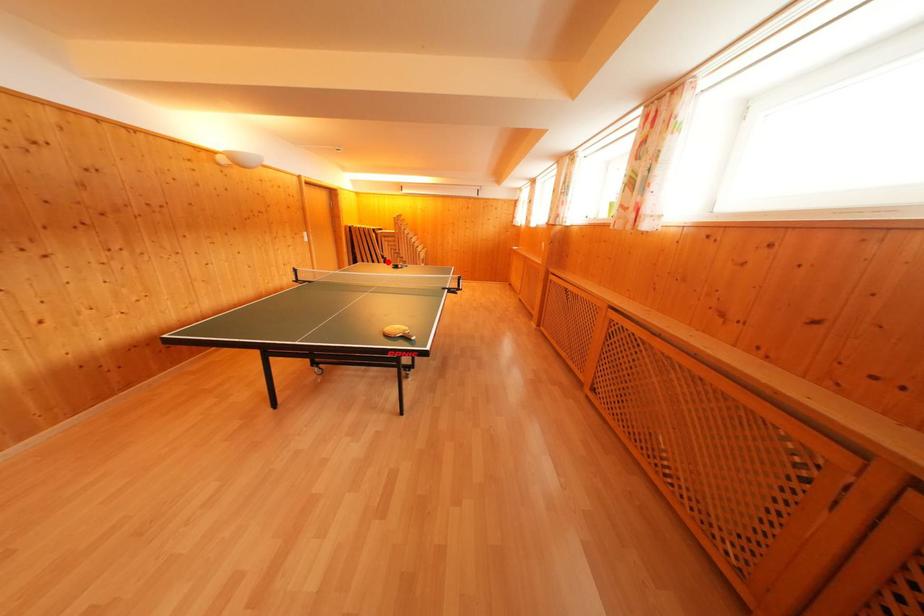
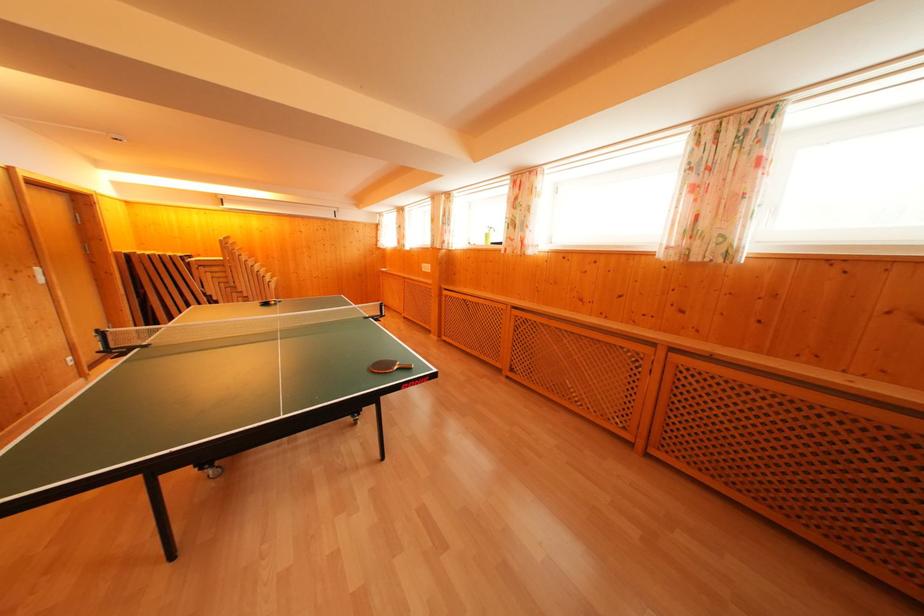
Question: I am providing you with two images of the same scene from different viewpoints. A red point is marked on the first image. At the location where the point appears in image 1, is it still visible in image 2?

Choices:
 (A) Yes
 (B) No

Answer: (A)